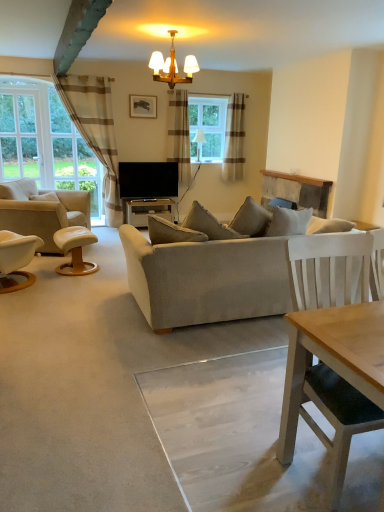
Question: Is white leather stool at left to the right of plaid fabric curtain at center, the 2th curtain positioned from the left, from the viewer's perspective?

Choices:
 (A) no
 (B) yes

Answer: (A)

Question: Does white leather stool at left have a larger size compared to plaid fabric curtain at center, marked as the 2th curtain in a right-to-left arrangement?

Choices:
 (A) no
 (B) yes

Answer: (A)

Question: Can you see white leather stool at left touching plaid fabric curtain at center, the 2th curtain positioned from the left?

Choices:
 (A) yes
 (B) no

Answer: (B)

Question: Can you confirm if white leather stool at left is taller than plaid fabric curtain at center, the 2th curtain positioned from the left?

Choices:
 (A) yes
 (B) no

Answer: (B)

Question: Does white leather stool at left have a lesser width compared to plaid fabric curtain at center, the 2th curtain positioned from the left?

Choices:
 (A) yes
 (B) no

Answer: (B)

Question: Is white leather stool at left wider than plaid fabric curtain at center, marked as the 2th curtain in a right-to-left arrangement?

Choices:
 (A) yes
 (B) no

Answer: (A)

Question: Is white leather ottoman at left taller than light beige fabric couch at center?

Choices:
 (A) no
 (B) yes

Answer: (A)

Question: Are white leather ottoman at left and light beige fabric couch at center located far from each other?

Choices:
 (A) yes
 (B) no

Answer: (A)

Question: From a real-world perspective, is white leather ottoman at left on top of light beige fabric couch at center?

Choices:
 (A) yes
 (B) no

Answer: (B)

Question: Is white leather ottoman at left oriented away from light beige fabric couch at center?

Choices:
 (A) no
 (B) yes

Answer: (A)

Question: Is white leather ottoman at left surrounding light beige fabric couch at center?

Choices:
 (A) no
 (B) yes

Answer: (A)

Question: Is white leather ottoman at left not inside light beige fabric couch at center?

Choices:
 (A) no
 (B) yes

Answer: (B)

Question: Is brown striped curtain at left, which is the 1th curtain in left-to-right order, to the left of light beige fabric couch at center from the viewer's perspective?

Choices:
 (A) yes
 (B) no

Answer: (A)